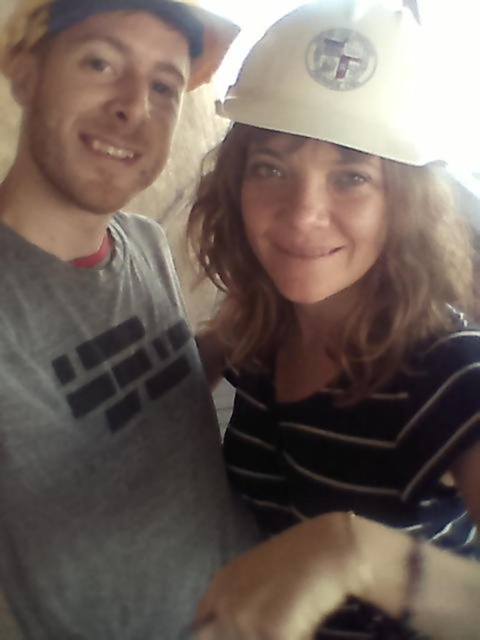
You are taking a photo of two people in a casual setting. The gray matte t shirt at left is represented by point [103,332]. Where should you position your camera to ensure the gray matte t shirt at left is centered in the frame?

To center the gray matte t shirt at left represented by point [103,332], position the camera so that the point [103,332] is at the center of the frame.